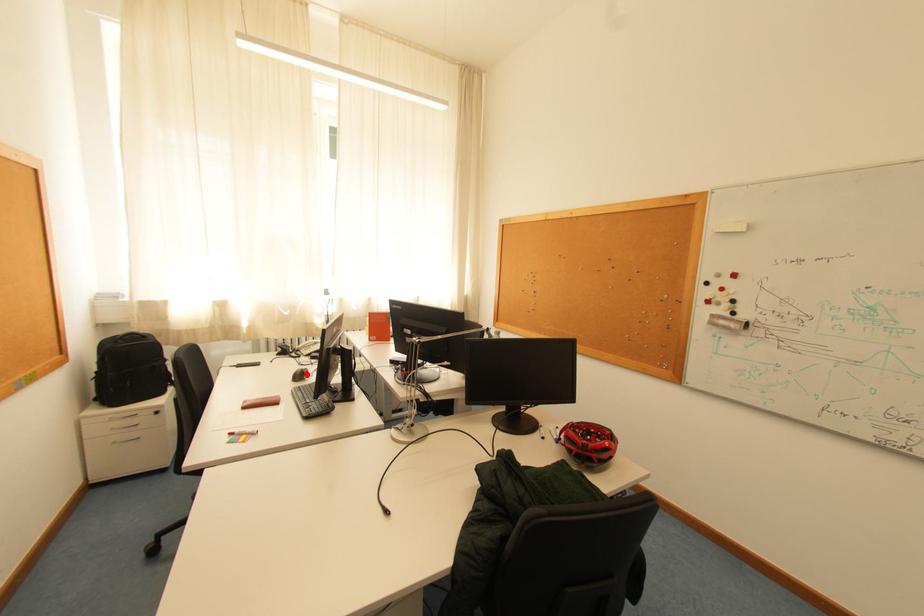
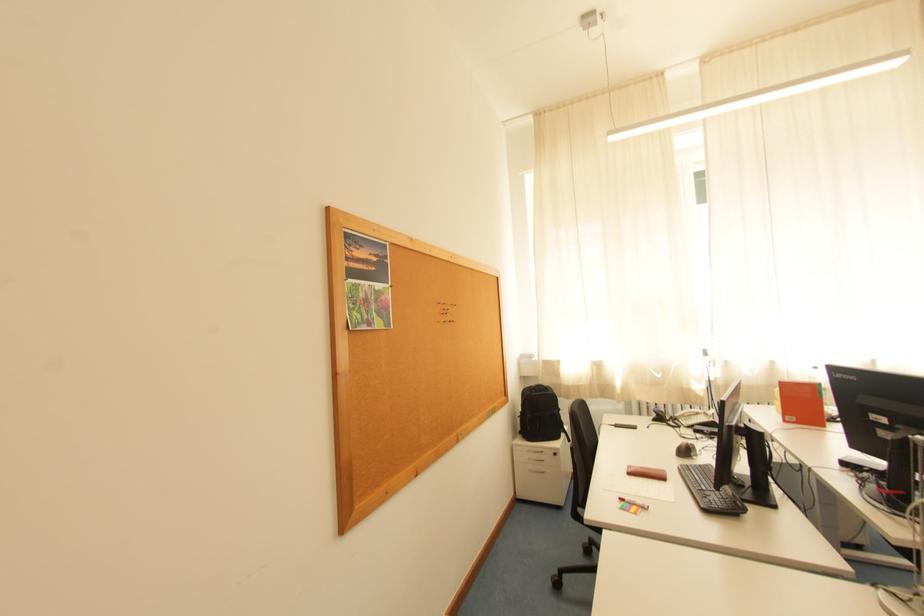
Question: I am providing you with two images of the same scene from different viewpoints. A red point is marked on the first image. Can you still see the location of the red point in image 2?

Choices:
 (A) Yes
 (B) No

Answer: (A)